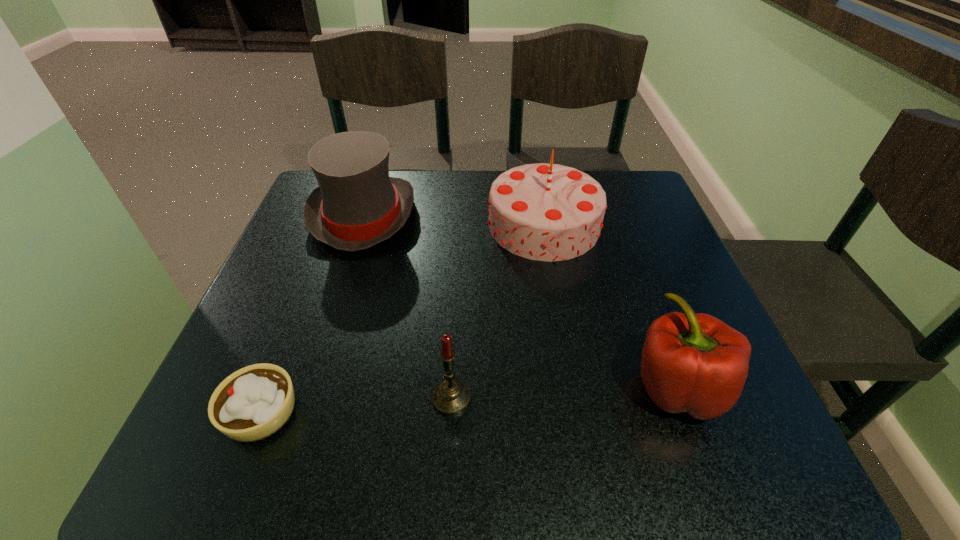
Where is `object that is at the far right corner`? The width and height of the screenshot is (960, 540). object that is at the far right corner is located at coordinates (547, 212).

Locate an element on the screen. object situated at the near right corner is located at coordinates (695, 363).

In the image, there is a desktop. Where is `free space at the far edge`? free space at the far edge is located at coordinates (413, 171).

Where is `vacant space at the near edge of the desktop`? The image size is (960, 540). vacant space at the near edge of the desktop is located at coordinates (499, 419).

In the image, there is a desktop. At what (x,y) coordinates should I click in order to perform the action: click on vacant space at the left edge. Please return your answer as a coordinate pair (x, y). The image size is (960, 540). Looking at the image, I should click on (315, 264).

You are a GUI agent. You are given a task and a screenshot of the screen. Output one action in this format:
    pyautogui.click(x=<x>, y=<y>)
    Task: Click on the vacant position at the right edge of the desktop
    This screenshot has height=540, width=960.
    Given the screenshot: What is the action you would take?
    pyautogui.click(x=635, y=230)

Where is `free space at the near left corner`? free space at the near left corner is located at coordinates (262, 456).

Image resolution: width=960 pixels, height=540 pixels. Find the location of `free space at the far right corner of the desktop`. free space at the far right corner of the desktop is located at coordinates (660, 209).

At what (x,y) coordinates should I click in order to perform the action: click on free space between the dress hat and the birthday cake. Please return your answer as a coordinate pair (x, y). The width and height of the screenshot is (960, 540). Looking at the image, I should click on (454, 220).

Find the location of a particular element. vacant space in between the third object from left to right and the bell pepper is located at coordinates click(564, 393).